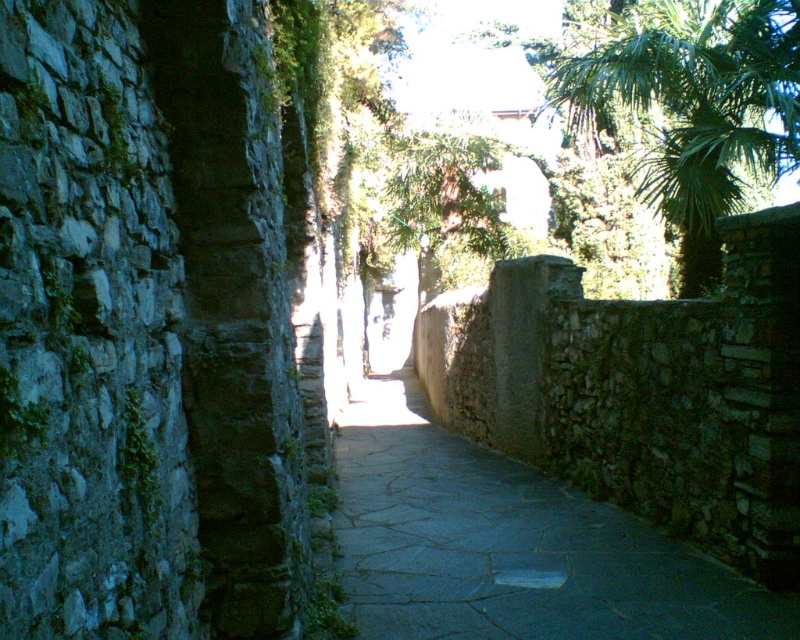
Is dark stone path at center shorter than green leafy palm tree at upper right?

Yes, dark stone path at center is shorter than green leafy palm tree at upper right.

Does point (432, 467) come farther from viewer compared to point (734, 164)?

No.

Between point (617, 625) and point (742, 136), which one is positioned behind?

The point (742, 136) is behind.

You are a GUI agent. You are given a task and a screenshot of the screen. Output one action in this format:
    pyautogui.click(x=<x>, y=<y>)
    Task: Click on the dark stone path at center
    The image size is (800, 640).
    Given the screenshot: What is the action you would take?
    pyautogui.click(x=512, y=545)